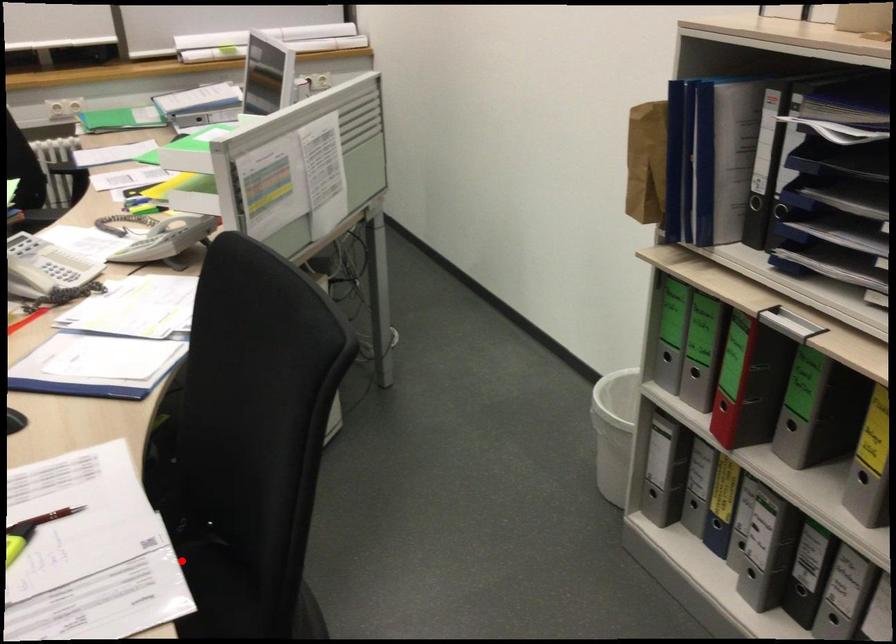
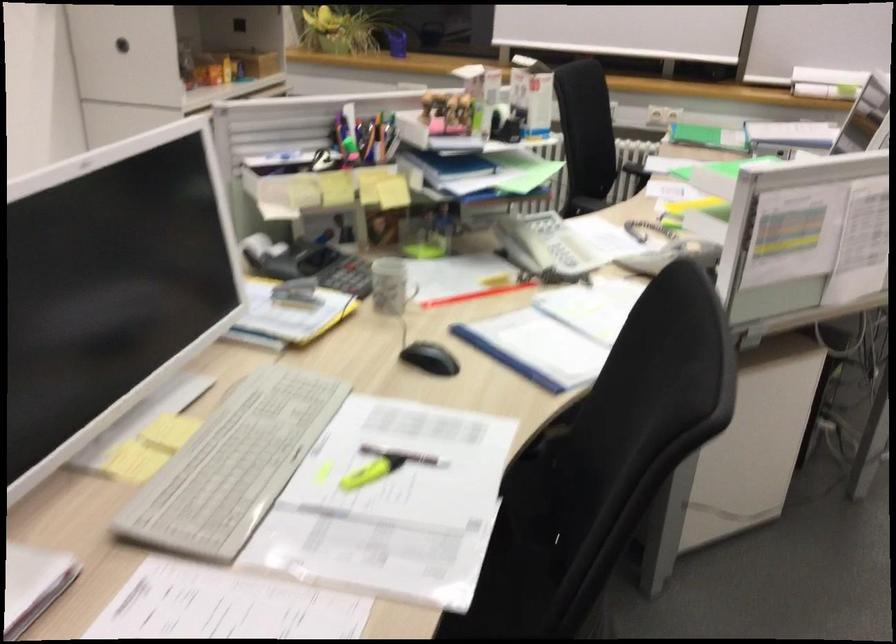
Find the pixel in the second image that matches the highlighted location in the first image.

(518, 554)